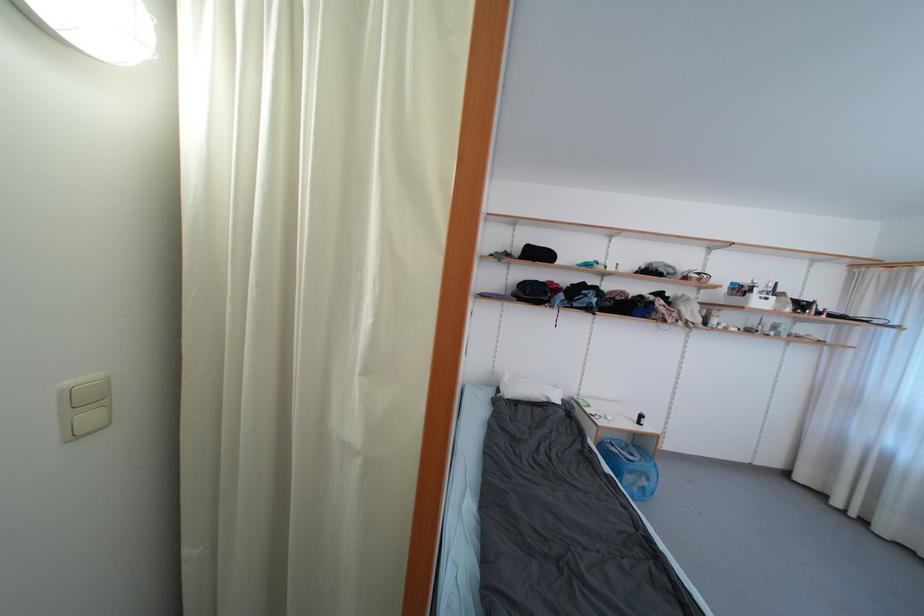
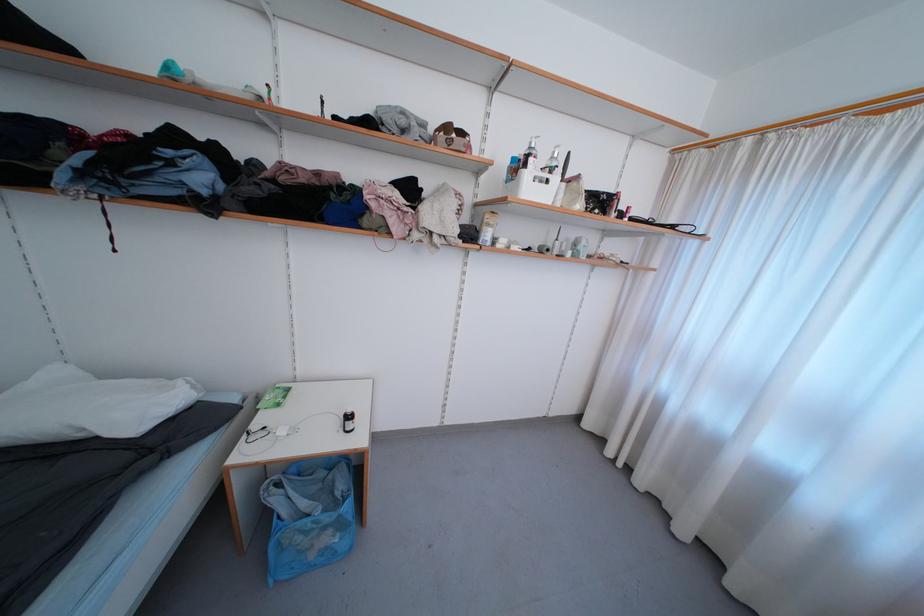
Locate, in the second image, the point that corresponds to point 758,299 in the first image.

(531, 177)